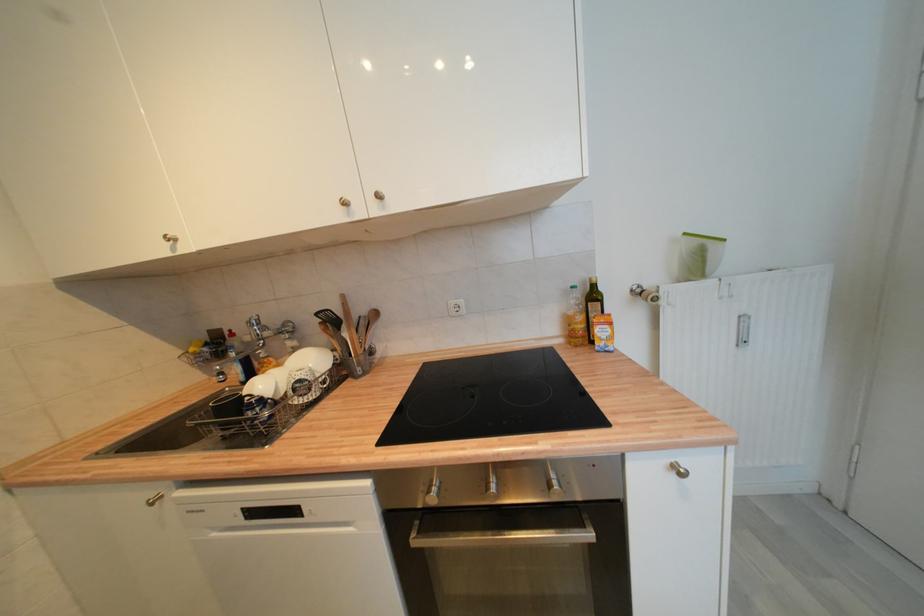
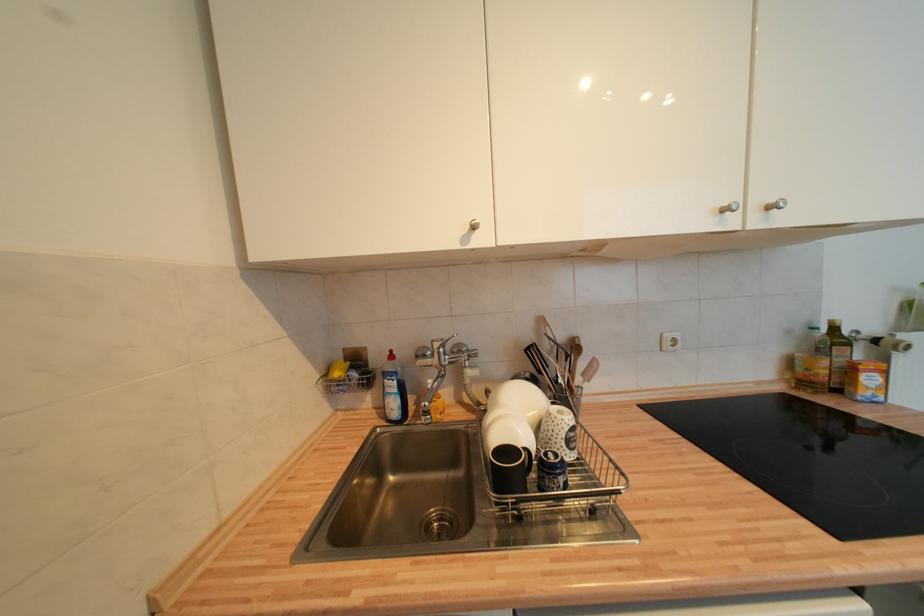
In the second image, find the point that corresponds to (606,342) in the first image.

(873, 391)